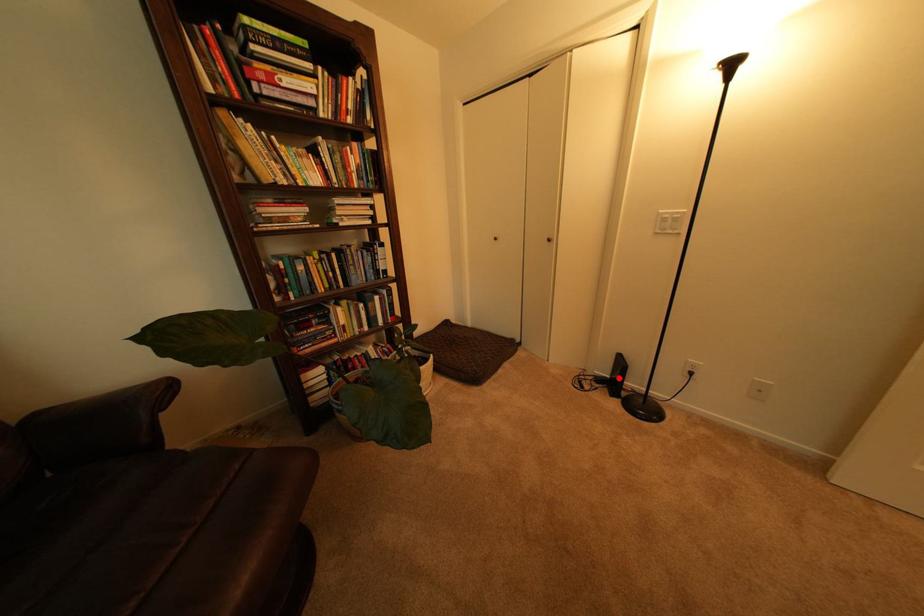
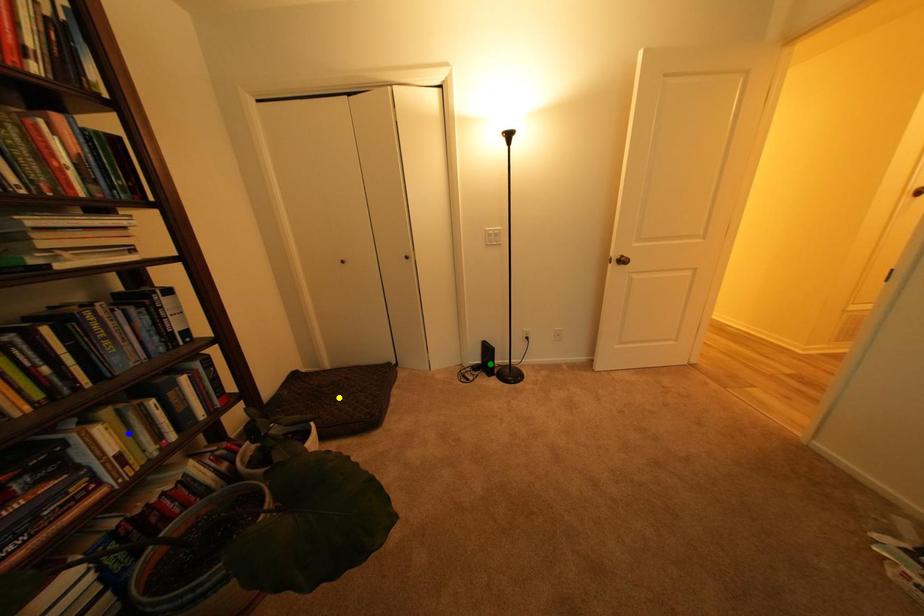
Question: I am providing you with two images of the same scene from different viewpoints. A red point is marked on the first image. You are given multiple points on the second image. Which spot in image 2 lines up with the point in image 1?

Choices:
 (A) green point
 (B) blue point
 (C) yellow point

Answer: (A)